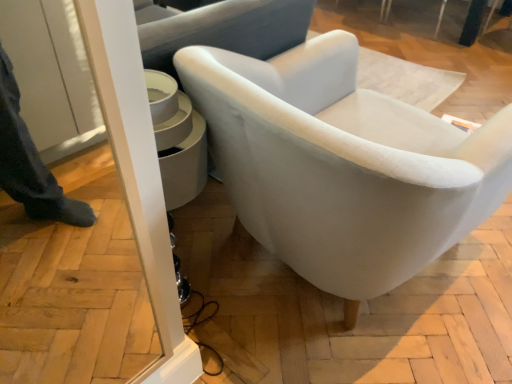
I want to click on white fabric chair at center, so click(342, 165).

Image resolution: width=512 pixels, height=384 pixels. What do you see at coordinates (342, 165) in the screenshot?
I see `white fabric chair at center` at bounding box center [342, 165].

Locate an element on the screen. The height and width of the screenshot is (384, 512). white fabric chair at center is located at coordinates (342, 165).